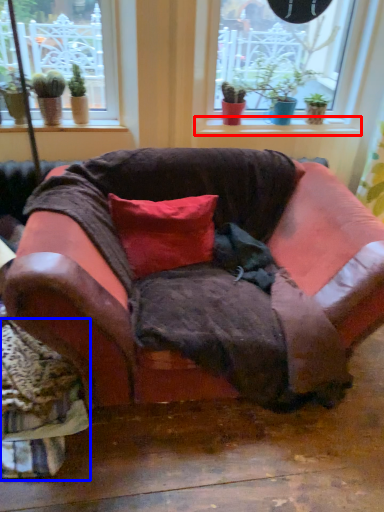
Question: Which object appears closest to the camera in this image, window sill (highlighted by a red box) or swivel chair (highlighted by a blue box)?

Choices:
 (A) window sill
 (B) swivel chair

Answer: (B)